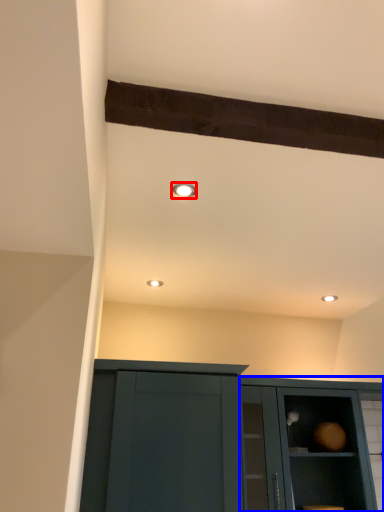
Question: Which point is further to the camera, lighting (highlighted by a red box) or cabinetry (highlighted by a blue box)?

Choices:
 (A) lighting
 (B) cabinetry

Answer: (B)